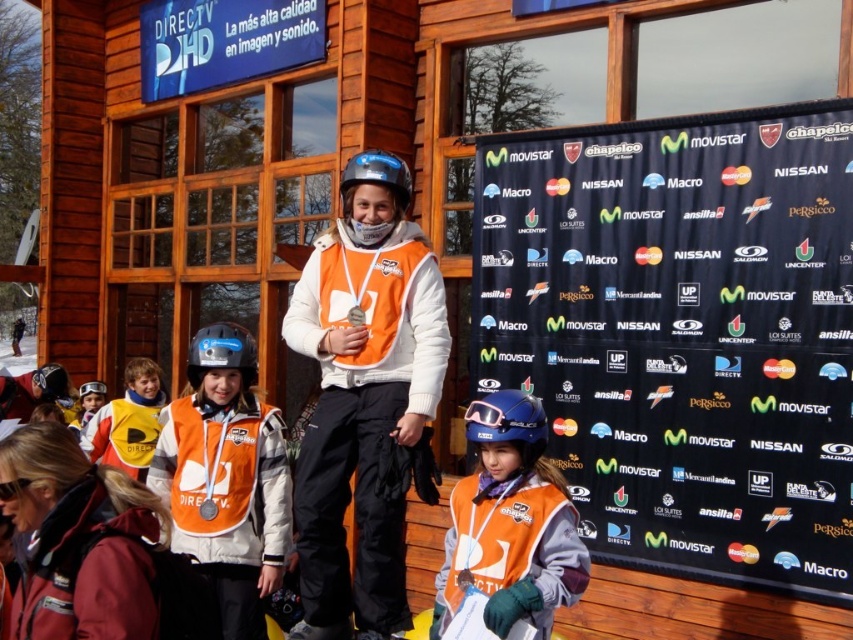
Question: Is orange fabric vest at center below orange matte vest at center?

Choices:
 (A) yes
 (B) no

Answer: (B)

Question: Which object appears closest to the camera in this image?

Choices:
 (A) orange matte vest at center
 (B) orange fabric vest at center
 (C) transparent plastic goggles at lower left
 (D) yellowmaterialjacket at left

Answer: (C)

Question: Considering the relative positions of orange matte vest at center and yellowmaterialjacket at left in the image provided, where is orange matte vest at center located with respect to yellowmaterialjacket at left?

Choices:
 (A) left
 (B) right

Answer: (B)

Question: Is matte orange vest at center closer to the viewer compared to orange matte vest at center?

Choices:
 (A) yes
 (B) no

Answer: (B)

Question: Which is farther from the yellowmaterialjacket at left?

Choices:
 (A) orange fabric vest at center
 (B) orange matte vest at center
 (C) transparent plastic goggles at lower left

Answer: (B)

Question: Which point is farther from the camera taking this photo?

Choices:
 (A) (514, 476)
 (B) (146, 460)
 (C) (28, 480)
 (D) (674, 433)

Answer: (B)